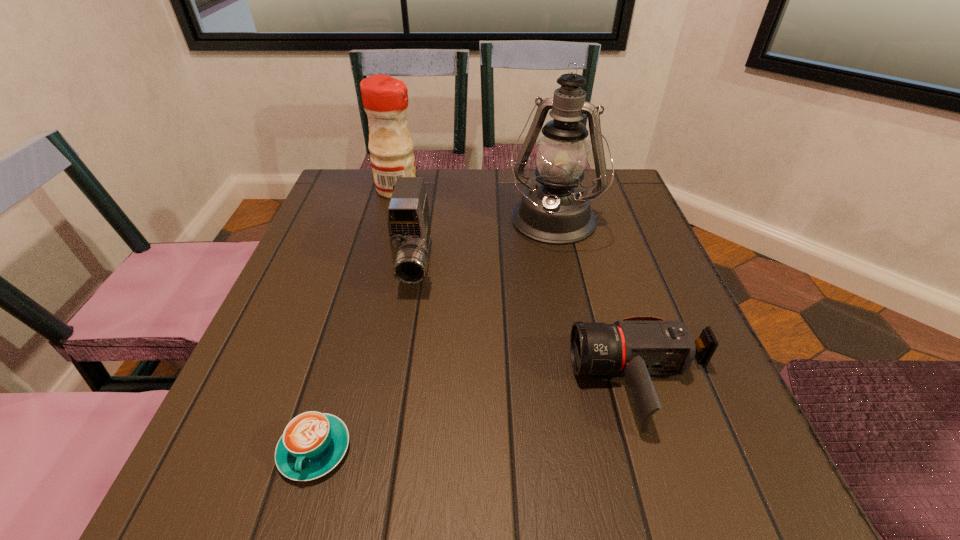
At what (x,y) coordinates should I click in order to perform the action: click on object at the far left corner. Please return your answer as a coordinate pair (x, y). Looking at the image, I should click on (385, 99).

Locate an element on the screen. The image size is (960, 540). object that is at the near left corner is located at coordinates (313, 443).

The width and height of the screenshot is (960, 540). Find the location of `object that is at the far right corner`. object that is at the far right corner is located at coordinates (556, 211).

In the image, there is a desktop. Where is `vacant space at the far edge`? vacant space at the far edge is located at coordinates (451, 171).

In the image, there is a desktop. At what (x,y) coordinates should I click in order to perform the action: click on blank space at the near edge. Please return your answer as a coordinate pair (x, y). This screenshot has width=960, height=540. Looking at the image, I should click on (521, 462).

In the image, there is a desktop. At what (x,y) coordinates should I click in order to perform the action: click on free space at the left edge. Please return your answer as a coordinate pair (x, y). Looking at the image, I should click on (310, 248).

Locate an element on the screen. This screenshot has height=540, width=960. free space at the right edge of the desktop is located at coordinates (666, 301).

Locate an element on the screen. blank space at the far left corner is located at coordinates (381, 218).

The height and width of the screenshot is (540, 960). Find the location of `free space between the second shortest object and the oil lamp`. free space between the second shortest object and the oil lamp is located at coordinates (597, 303).

Where is `vacant space that's between the shorter camcorder and the cappuccino`? vacant space that's between the shorter camcorder and the cappuccino is located at coordinates (479, 416).